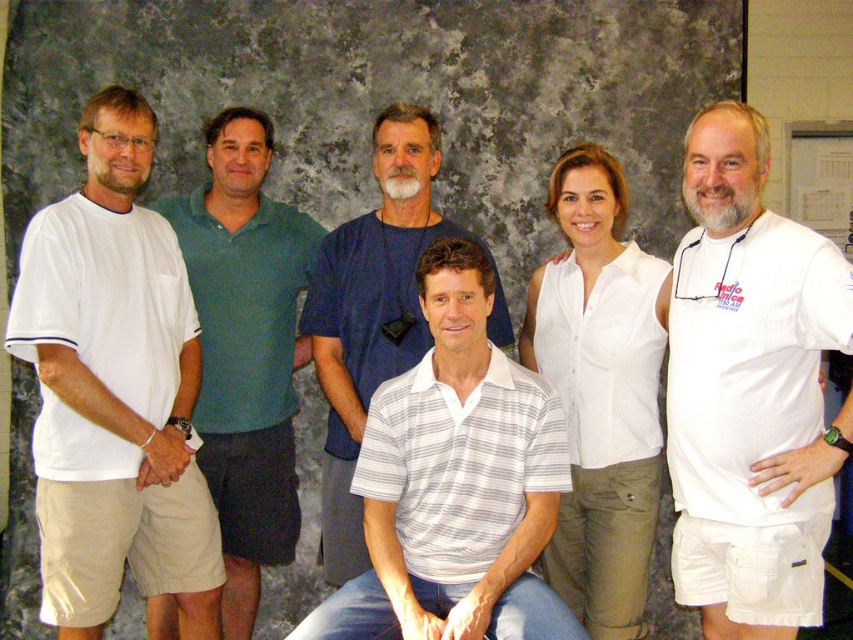
Question: Considering the real-world distances, which object is farthest from the white button-up shirt at center?

Choices:
 (A) white striped polo shirt at center
 (B) white cotton t-shirt at center
 (C) green polo shirt at center
 (D) white cotton t-shirt at left

Answer: (D)

Question: Which point is closer to the camera?

Choices:
 (A) white button-up shirt at center
 (B) white striped polo shirt at center
 (C) white cotton t-shirt at center

Answer: (C)

Question: Which point is closer to the camera?

Choices:
 (A) (293, 506)
 (B) (727, 234)
 (C) (636, 353)
 (D) (430, 157)

Answer: (B)

Question: Does white cotton t-shirt at center appear under white striped polo shirt at center?

Choices:
 (A) no
 (B) yes

Answer: (B)

Question: Does white cotton t-shirt at left appear under green polo shirt at center?

Choices:
 (A) no
 (B) yes

Answer: (A)

Question: Is white cotton t-shirt at left positioned in front of green polo shirt at center?

Choices:
 (A) no
 (B) yes

Answer: (B)